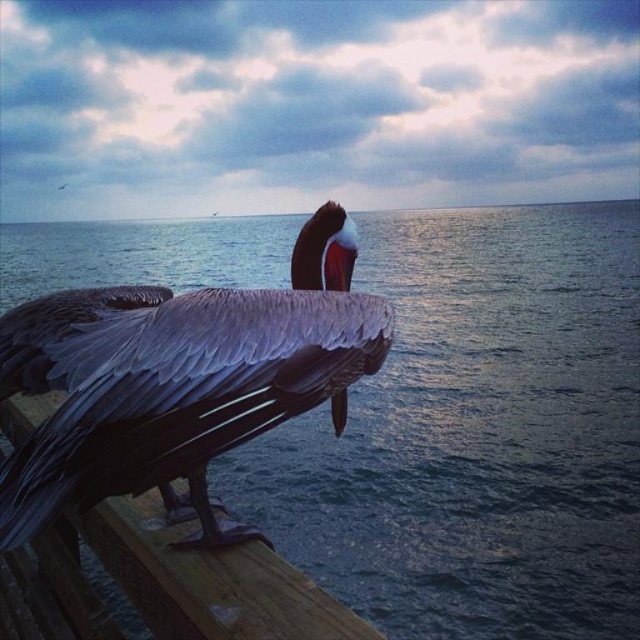
Consider the image. Who is lower down, gray feathered pelican at center or wooden at left?

wooden at left is below.

Can you confirm if gray feathered pelican at center is shorter than wooden at left?

Incorrect, gray feathered pelican at center's height does not fall short of wooden at left's.

The image size is (640, 640). What do you see at coordinates (179, 378) in the screenshot?
I see `gray feathered pelican at center` at bounding box center [179, 378].

In order to click on gray feathered pelican at center in this screenshot , I will do `click(179, 378)`.